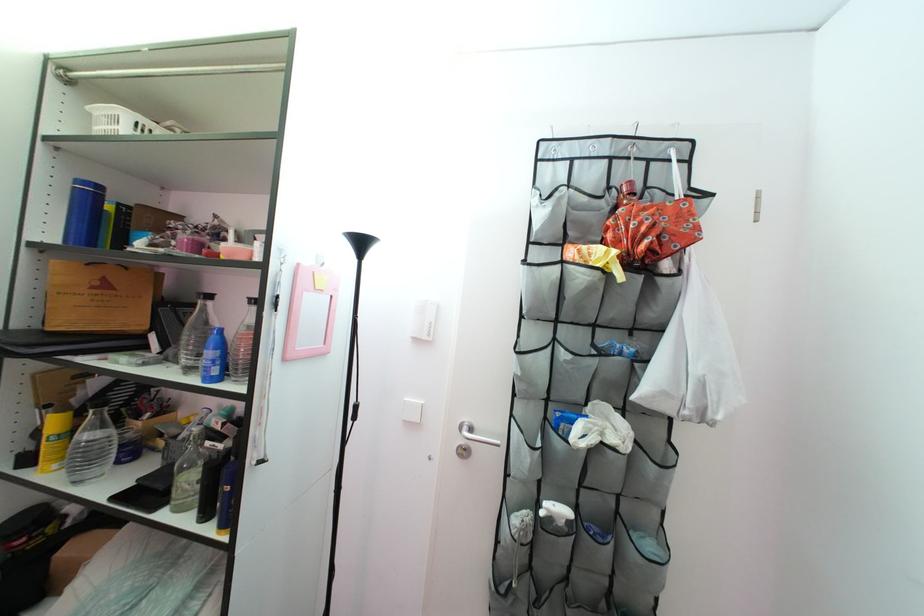
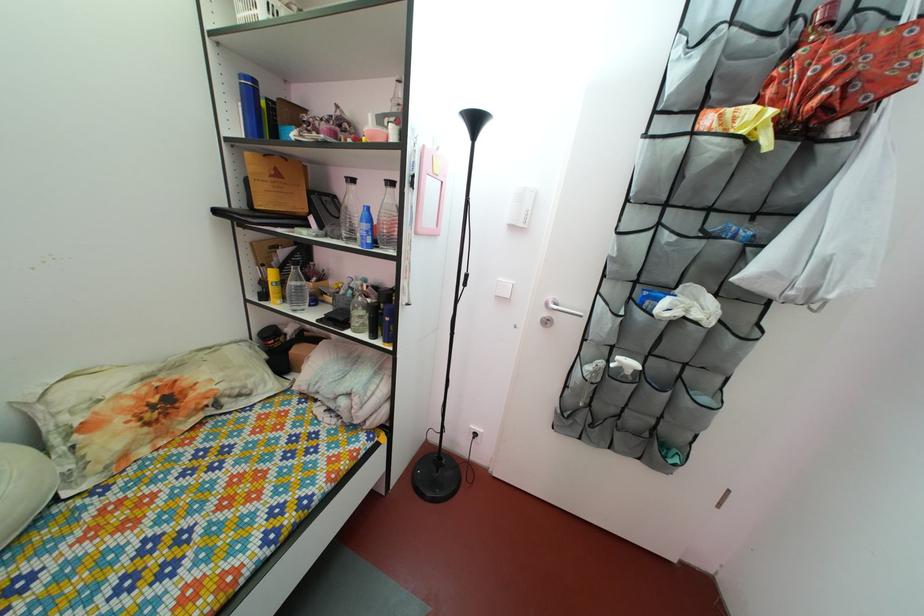
In the second image, find the point that corresponds to the point at 645,249 in the first image.

(816, 103)